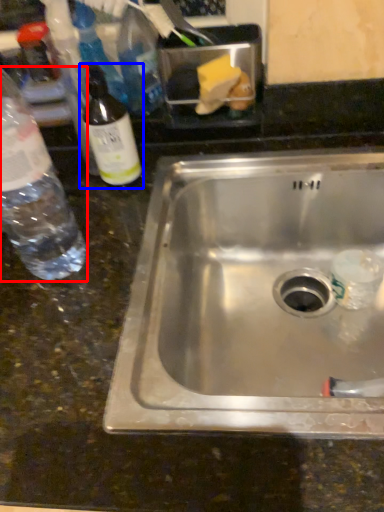
Question: Which object is further to the camera taking this photo, bottle (highlighted by a red box) or bottle (highlighted by a blue box)?

Choices:
 (A) bottle
 (B) bottle

Answer: (B)